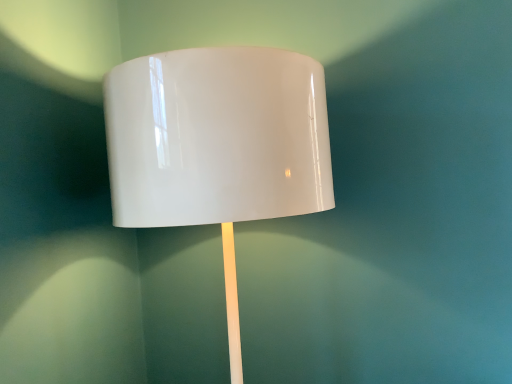
This screenshot has height=384, width=512. Describe the element at coordinates (217, 145) in the screenshot. I see `glossy white lampshade at center` at that location.

Locate an element on the screen. glossy white lampshade at center is located at coordinates (217, 145).

You are a GUI agent. You are given a task and a screenshot of the screen. Output one action in this format:
    pyautogui.click(x=<x>, y=<y>)
    Task: Click on the glossy white lampshade at center
    
    Given the screenshot: What is the action you would take?
    pyautogui.click(x=217, y=145)